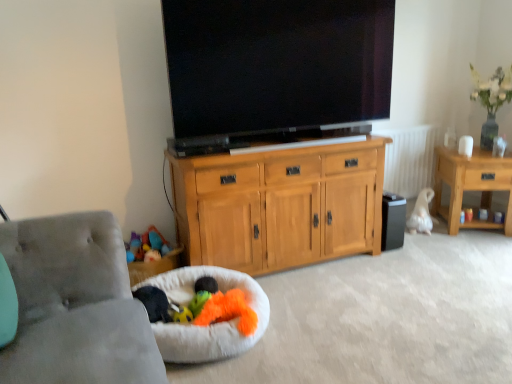
Question: From a real-world perspective, is smooth plastic cup at right, the 3th toy when ordered from front to back, positioned above or below white fluffy dog bed at lower left?

Choices:
 (A) below
 (B) above

Answer: (B)

Question: From the image's perspective, relative to white fluffy dog bed at lower left, is smooth plastic cup at right, marked as the 3th toy in a bottom-to-top arrangement, above or below?

Choices:
 (A) below
 (B) above

Answer: (B)

Question: Estimate the real-world distances between objects in this image. Which object is closer to the white fluffy dog bed at lower left?

Choices:
 (A) black glossy flat-screen tv at center
 (B) gray fabric studio couch at lower left
 (C) wooden side table at right
 (D) black plastic speaker at lower right
 (E) soft plush toy at lower center, acting as the 1th toy starting from the left

Answer: (E)

Question: Considering the real-world distances, which object is farthest from the black glossy flat-screen tv at center?

Choices:
 (A) light wood cabinet at center
 (B) gray fabric studio couch at lower left
 (C) wooden side table at right
 (D) black plastic speaker at lower right
 (E) smooth plastic cup at right, marked as the 3th toy in a bottom-to-top arrangement

Answer: (E)